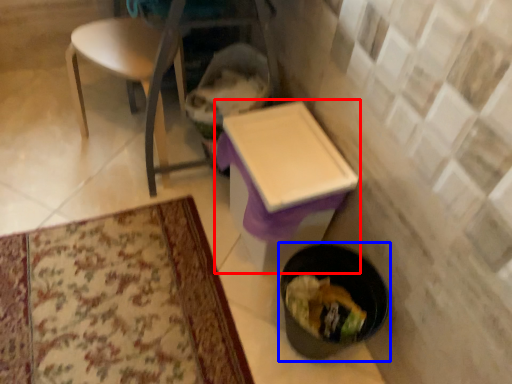
Question: Which of the following is the closest to the observer, table (highlighted by a red box) or potty (highlighted by a blue box)?

Choices:
 (A) table
 (B) potty

Answer: (B)